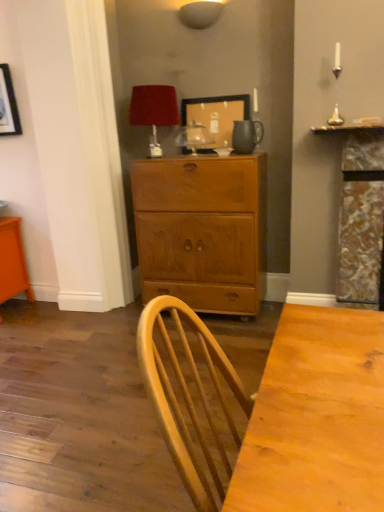
I want to click on vacant space situated above wooden picture frame at upper center (from a real-world perspective), so click(218, 94).